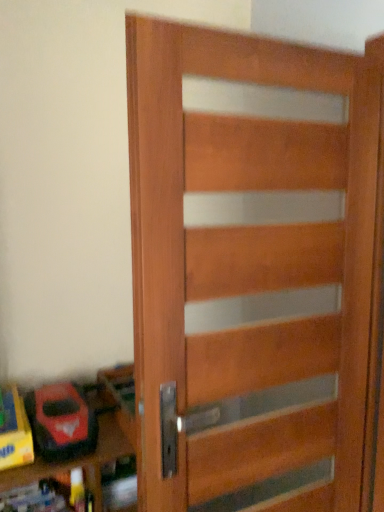
The height and width of the screenshot is (512, 384). Find the location of `vacant area on top of rubberized red toy car at lower left (from a real-world perspective)`. vacant area on top of rubberized red toy car at lower left (from a real-world perspective) is located at coordinates (58, 395).